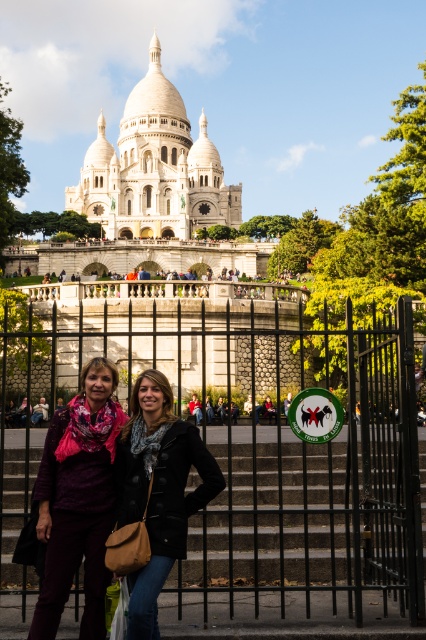
Question: Is black wrought iron gate at center behind matte purple scarf at center?

Choices:
 (A) yes
 (B) no

Answer: (A)

Question: Does matte purple scarf at center appear over black leather jacket at center?

Choices:
 (A) no
 (B) yes

Answer: (A)

Question: Which object is closer to the camera taking this photo?

Choices:
 (A) black leather jacket at center
 (B) black wrought iron gate at center

Answer: (A)

Question: Which object appears closest to the camera in this image?

Choices:
 (A) matte purple scarf at center
 (B) white stone palace at upper center

Answer: (A)

Question: Is white stone palace at upper center to the right of matte purple scarf at center from the viewer's perspective?

Choices:
 (A) no
 (B) yes

Answer: (A)

Question: Which object is positioned closest to the white stone palace at upper center?

Choices:
 (A) black wrought iron gate at center
 (B) black leather jacket at center
 (C) matte purple scarf at center

Answer: (A)